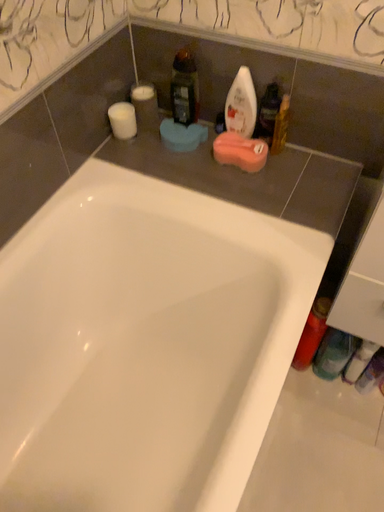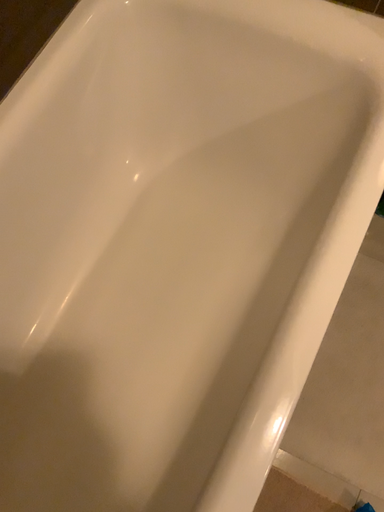
Question: How did the camera likely rotate when shooting the video?

Choices:
 (A) rotated downward
 (B) rotated upward

Answer: (A)